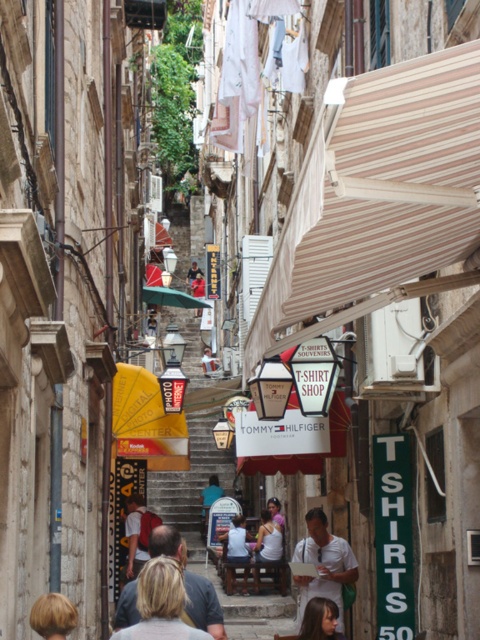
Question: Is blonde hair at lower left to the right of light blue shirt at center from the viewer's perspective?

Choices:
 (A) no
 (B) yes

Answer: (B)

Question: Can you confirm if stone staircase at center is thinner than blonde hair at lower left?

Choices:
 (A) yes
 (B) no

Answer: (B)

Question: Among these objects, which one is farthest from the camera?

Choices:
 (A) blonde hair at lower left
 (B) light blue fabric shirt at center
 (C) light blue shirt at center

Answer: (C)

Question: Among these objects, which one is farthest from the camera?

Choices:
 (A) blonde hair at lower left
 (B) stone staircase at center

Answer: (B)

Question: Considering the real-world distances, which object is farthest from the light blue shirt at center?

Choices:
 (A) white cotton shirt at center
 (B) blonde hair at lower center
 (C) white cotton tank top at center

Answer: (B)

Question: Observing the image, what is the correct spatial positioning of blonde hair at center in reference to light blue fabric shirt at center?

Choices:
 (A) left
 (B) right

Answer: (B)